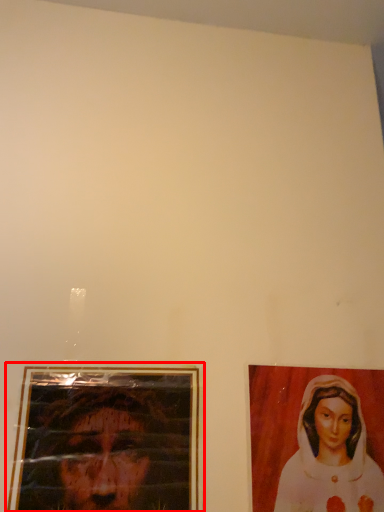
Question: From the image's perspective, where is picture frame (annotated by the red box) located relative to woman?

Choices:
 (A) above
 (B) below

Answer: (A)